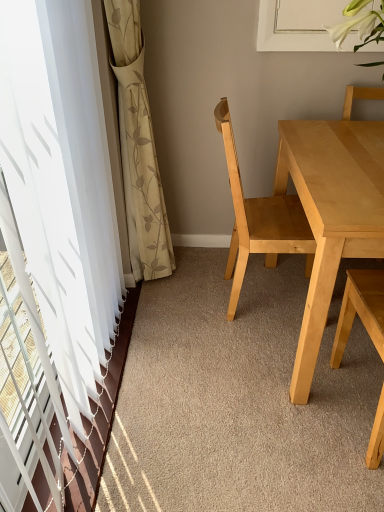
Where is `vacant point to the left of light wood chair at center, the 2th chair in the right-to-left sequence`? vacant point to the left of light wood chair at center, the 2th chair in the right-to-left sequence is located at coordinates (192, 306).